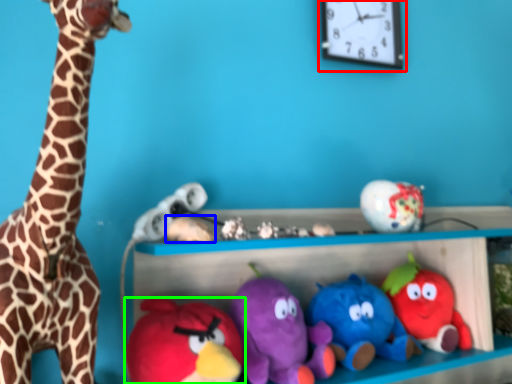
Question: Which object is positioned closest to clock (highlighted by a red box)? Select from toy (highlighted by a blue box) and toy (highlighted by a green box).

Choices:
 (A) toy
 (B) toy

Answer: (A)